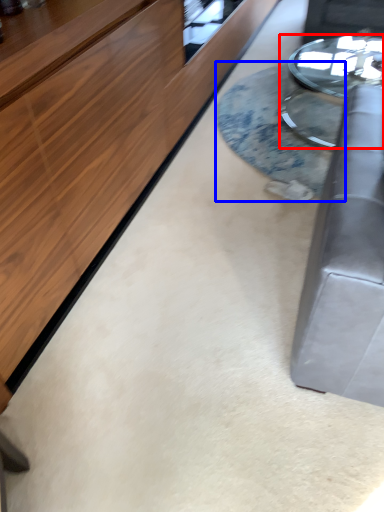
Question: Which of the following is the closest to the observer, table (highlighted by a red box) or table (highlighted by a blue box)?

Choices:
 (A) table
 (B) table

Answer: (B)